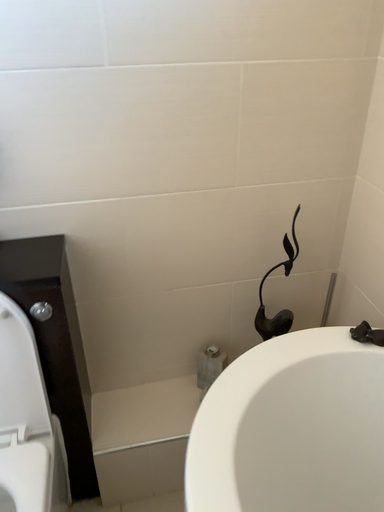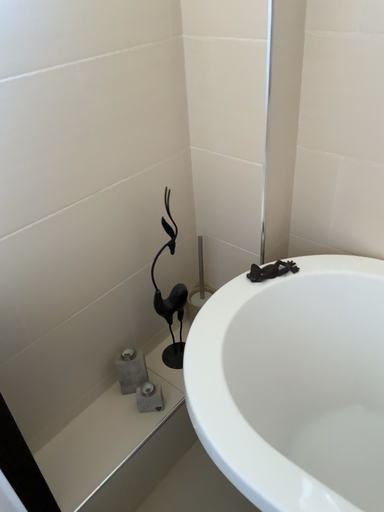
Question: Which way did the camera rotate in the video?

Choices:
 (A) rotated right
 (B) rotated left

Answer: (A)